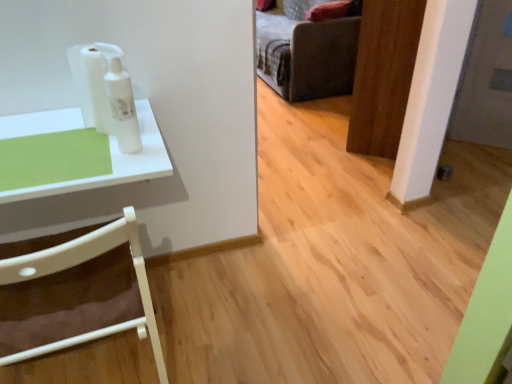
Measure the distance between point (396, 138) and camera.

They are 2.54 meters apart.

What do you see at coordinates (121, 100) in the screenshot?
I see `white glossy lotion at upper left` at bounding box center [121, 100].

You are a GUI agent. You are given a task and a screenshot of the screen. Output one action in this format:
    pyautogui.click(x=<x>, y=<y>)
    Task: Click on the dark gray fabric couch at upper center
    
    Given the screenshot: What is the action you would take?
    pyautogui.click(x=306, y=52)

The height and width of the screenshot is (384, 512). In order to click on wooden door at center in this screenshot , I will do 383,75.

Is dark gray fabric couch at upper center shorter than white glossy lotion at upper left?

No.

Considering the relative sizes of dark gray fabric couch at upper center and white glossy lotion at upper left in the image provided, is dark gray fabric couch at upper center thinner than white glossy lotion at upper left?

Incorrect, the width of dark gray fabric couch at upper center is not less than that of white glossy lotion at upper left.

Is point (257, 11) positioned behind point (110, 84)?

Yes, point (257, 11) is farther from viewer.

Is wooden door at center oriented towards white glossy lotion at upper left?

No, wooden door at center is not aimed at white glossy lotion at upper left.

Is wooden door at center far from white glossy lotion at upper left?

wooden door at center is far away from white glossy lotion at upper left.

Where is `toiletry that appears in front of the wooden door at center`? This screenshot has width=512, height=384. toiletry that appears in front of the wooden door at center is located at coordinates (121, 100).

Measure the distance between white plastic chair at left and white glossy lotion at upper left.

They are 36.27 centimeters apart.

Is white plastic chair at left positioned beyond the bounds of white glossy lotion at upper left?

Indeed, white plastic chair at left is completely outside white glossy lotion at upper left.

Does white plastic chair at left have a greater height compared to white glossy lotion at upper left?

Correct, white plastic chair at left is much taller as white glossy lotion at upper left.

Which of these two, white plastic chair at left or white glossy lotion at upper left, is wider?

Wider between the two is white plastic chair at left.

Considering the sizes of objects white plastic chair at left and dark gray fabric couch at upper center in the image provided, who is bigger, white plastic chair at left or dark gray fabric couch at upper center?

dark gray fabric couch at upper center.

Would you say white plastic chair at left is to the left or to the right of dark gray fabric couch at upper center in the picture?

In the image, white plastic chair at left appears on the left side of dark gray fabric couch at upper center.

The width and height of the screenshot is (512, 384). Identify the location of furniture below the white plastic chair at left (from a real-world perspective). (306, 52).

Is white glossy lotion at upper left far from white plastic chair at left?

white glossy lotion at upper left is near white plastic chair at left, not far away.

Is white glossy lotion at upper left aimed at white plastic chair at left?

No, white glossy lotion at upper left is not oriented towards white plastic chair at left.

Is the position of white glossy lotion at upper left less distant than that of white plastic chair at left?

No, white glossy lotion at upper left is behind white plastic chair at left.

From the image's perspective, is wooden door at center on top of dark gray fabric couch at upper center?

Incorrect, from the image's perspective, wooden door at center is lower than dark gray fabric couch at upper center.

Is wooden door at center in contact with dark gray fabric couch at upper center?

No, wooden door at center is not with dark gray fabric couch at upper center.

Does point (373, 0) appear closer or farther from the camera than point (334, 94)?

Point (373, 0) is positioned closer to the camera compared to point (334, 94).

Which of these two, wooden door at center or dark gray fabric couch at upper center, is wider?

Wider between the two is dark gray fabric couch at upper center.

Considering the relative positions of dark gray fabric couch at upper center and white plastic chair at left in the image provided, is dark gray fabric couch at upper center to the left or to the right of white plastic chair at left?

Clearly, dark gray fabric couch at upper center is on the right of white plastic chair at left in the image.

Would you say dark gray fabric couch at upper center is outside white plastic chair at left?

Absolutely, dark gray fabric couch at upper center is external to white plastic chair at left.

Measure the distance from dark gray fabric couch at upper center to white plastic chair at left.

A distance of 2.76 meters exists between dark gray fabric couch at upper center and white plastic chair at left.

Consider the image. Would you say dark gray fabric couch at upper center is a long distance from white plastic chair at left?

Yes, dark gray fabric couch at upper center is far from white plastic chair at left.

You are a GUI agent. You are given a task and a screenshot of the screen. Output one action in this format:
    pyautogui.click(x=<x>, y=<y>)
    Task: Click on the toiletry that is above the dark gray fabric couch at upper center (from a real-world perspective)
    The image size is (512, 384).
    Given the screenshot: What is the action you would take?
    pyautogui.click(x=121, y=100)

Where is `door located on the right of white glossy lotion at upper left`? door located on the right of white glossy lotion at upper left is located at coordinates (383, 75).

From the image, which object appears to be farther from wooden door at center, white plastic chair at left or dark gray fabric couch at upper center?

white plastic chair at left is positioned further to the anchor wooden door at center.

From the image, which object appears to be nearer to white plastic chair at left, white glossy lotion at upper left or wooden door at center?

white glossy lotion at upper left.

Which object lies nearer to the anchor point dark gray fabric couch at upper center, white plastic chair at left or wooden door at center?

The object closer to dark gray fabric couch at upper center is wooden door at center.

Considering their positions, is white glossy lotion at upper left positioned further to white plastic chair at left than dark gray fabric couch at upper center?

dark gray fabric couch at upper center is positioned further to the anchor white plastic chair at left.

Based on the photo, when comparing their distances from wooden door at center, does dark gray fabric couch at upper center or white plastic chair at left seem closer?

The object closer to wooden door at center is dark gray fabric couch at upper center.

Considering their positions, is wooden door at center positioned closer to white glossy lotion at upper left than white plastic chair at left?

white plastic chair at left is positioned closer to the anchor white glossy lotion at upper left.

Estimate the real-world distances between objects in this image. Which object is closer to white plastic chair at left, dark gray fabric couch at upper center or wooden door at center?

Among the two, wooden door at center is located nearer to white plastic chair at left.

Which object lies further to the anchor point white glossy lotion at upper left, dark gray fabric couch at upper center or wooden door at center?

dark gray fabric couch at upper center is further to white glossy lotion at upper left.

You are a GUI agent. You are given a task and a screenshot of the screen. Output one action in this format:
    pyautogui.click(x=<x>, y=<y>)
    Task: Click on the door located between white glossy lotion at upper left and dark gray fabric couch at upper center in the depth direction
    This screenshot has width=512, height=384.
    Given the screenshot: What is the action you would take?
    pyautogui.click(x=383, y=75)

Locate an element on the screen. This screenshot has height=384, width=512. toiletry between white plastic chair at left and wooden door at center is located at coordinates (121, 100).

Identify the location of toiletry between white plastic chair at left and dark gray fabric couch at upper center in the front-back direction. This screenshot has width=512, height=384. (121, 100).

You are a GUI agent. You are given a task and a screenshot of the screen. Output one action in this format:
    pyautogui.click(x=<x>, y=<y>)
    Task: Click on the door between white plastic chair at left and dark gray fabric couch at upper center along the z-axis
    The width and height of the screenshot is (512, 384).
    Given the screenshot: What is the action you would take?
    pyautogui.click(x=383, y=75)